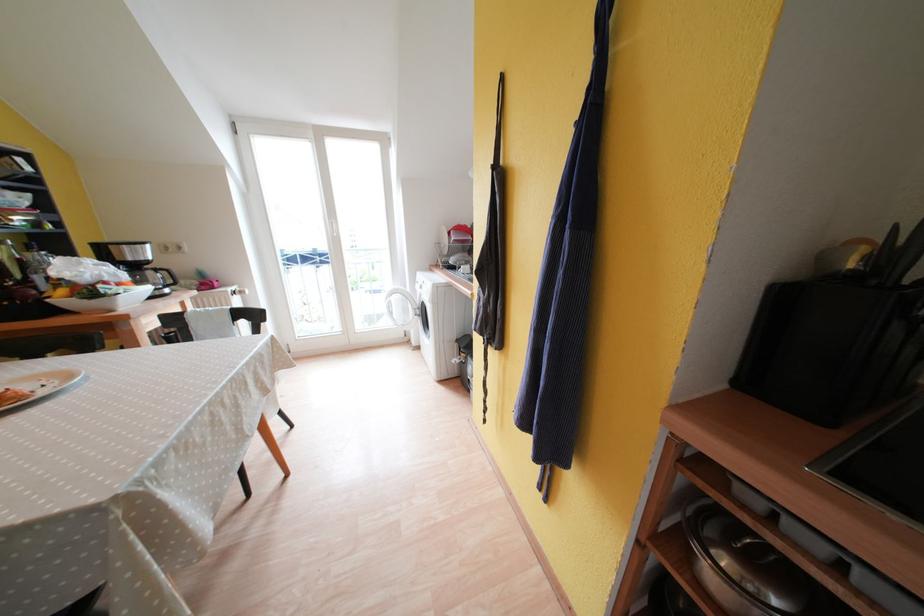
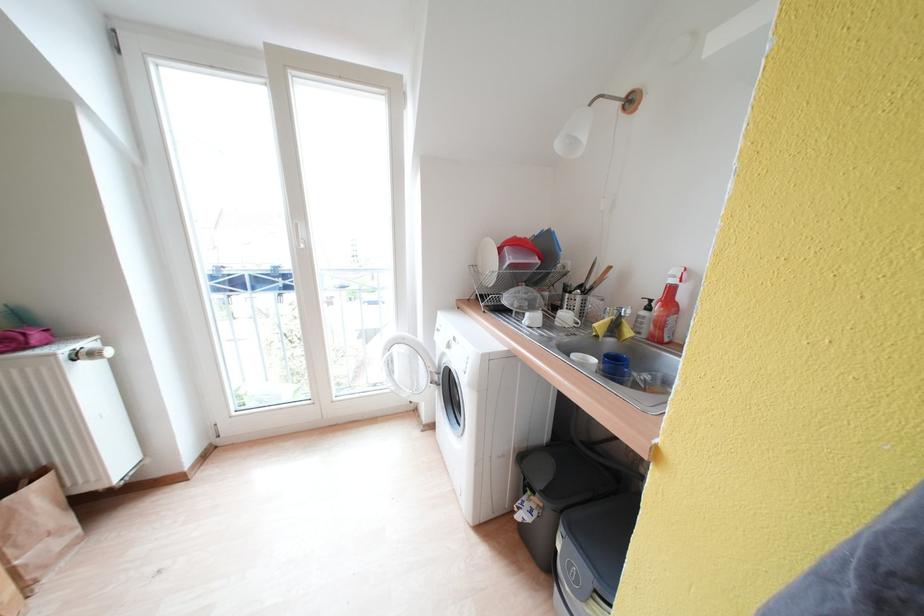
Where in the second image is the point corresponding to (x=219, y=292) from the first image?

(30, 351)